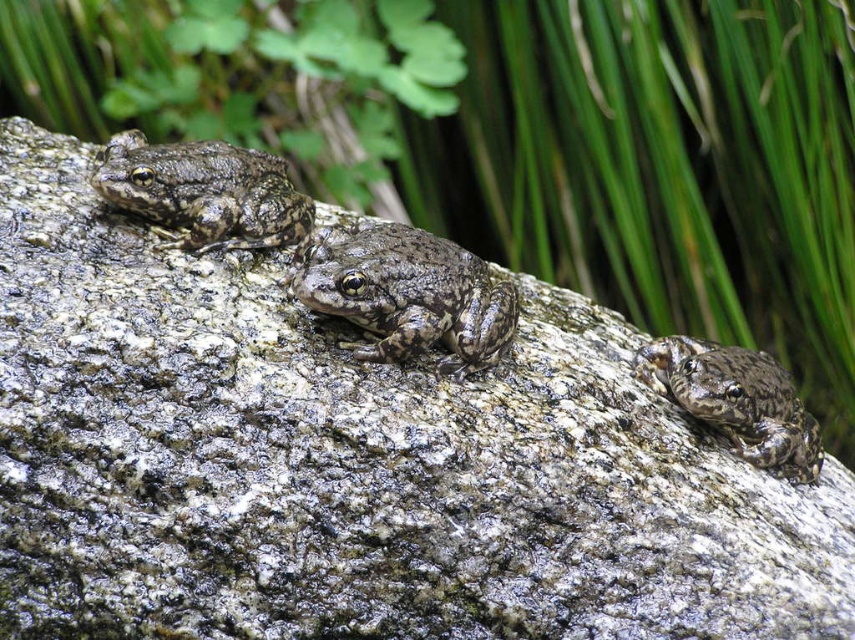
Who is positioned more to the right, camouflage skin frog at center or camouflage skin frog at lower right?

camouflage skin frog at lower right is more to the right.

Can you confirm if camouflage skin frog at center is thinner than camouflage skin frog at lower right?

Correct, camouflage skin frog at center's width is less than camouflage skin frog at lower right's.

Consider the image. Who is more forward, (513, 330) or (728, 396)?

Point (513, 330)

Where is `camouflage skin frog at center`? The width and height of the screenshot is (855, 640). camouflage skin frog at center is located at coordinates (405, 292).

Does camouflage skin frog at center have a greater height compared to camouflage skin frog at left?

Indeed, camouflage skin frog at center has a greater height compared to camouflage skin frog at left.

Where is `camouflage skin frog at center`? camouflage skin frog at center is located at coordinates [405, 292].

Who is higher up, camouflage skin frog at left or camouflage skin frog at lower right?

Positioned higher is camouflage skin frog at left.

Does point (186, 150) lie in front of point (739, 387)?

Yes.

This screenshot has height=640, width=855. In order to click on camouflage skin frog at left in this screenshot , I will do `click(204, 193)`.